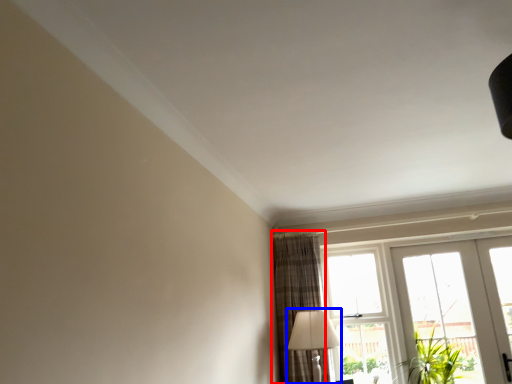
Question: Which point is closer to the camera, curtain (highlighted by a red box) or table lamp (highlighted by a blue box)?

Choices:
 (A) curtain
 (B) table lamp

Answer: (B)